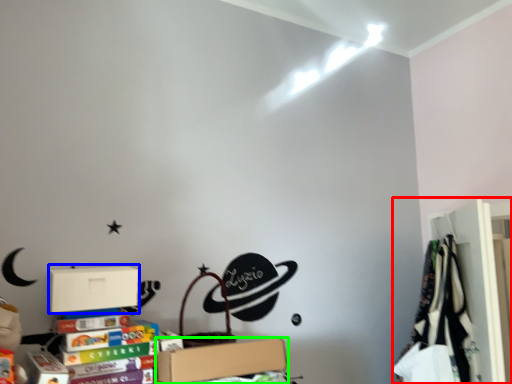
Question: Which is farther away from closet (highlighted by a red box)? cardboard box (highlighted by a blue box) or box (highlighted by a green box)?

Choices:
 (A) cardboard box
 (B) box

Answer: (A)